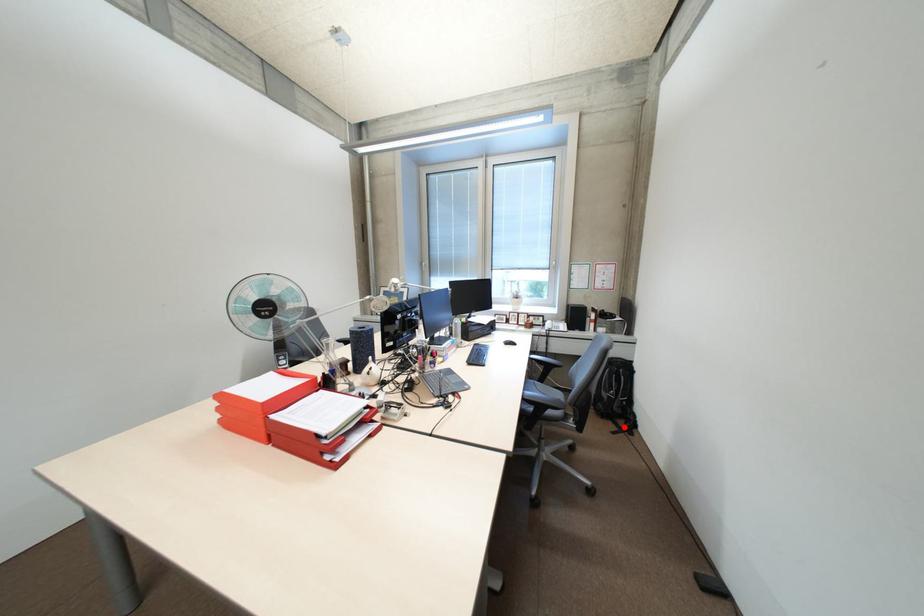
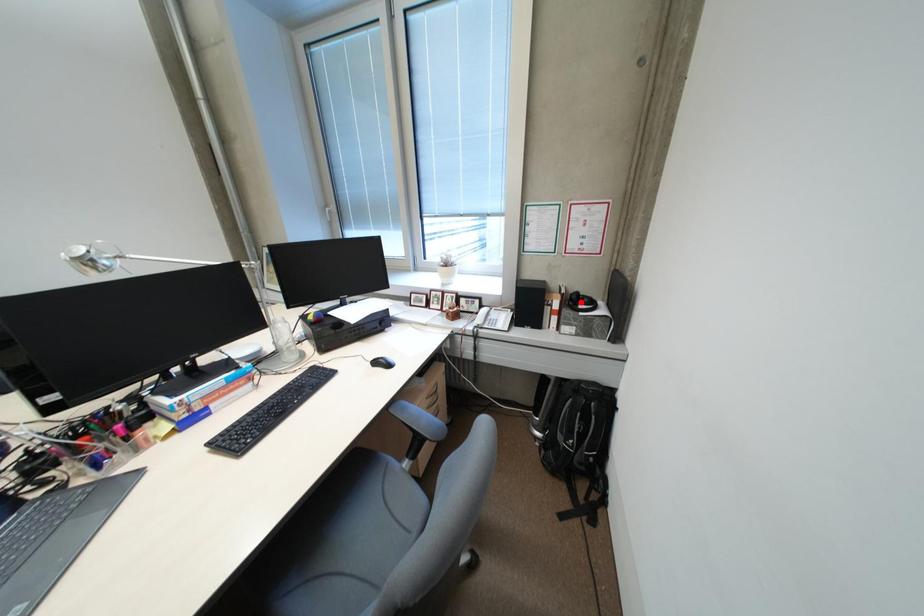
I am providing you with two images of the same scene from different viewpoints. A red point is marked on the first image and another point is marked on the second image. Do the highlighted points in image1 and image2 indicate the same real-world spot?

No